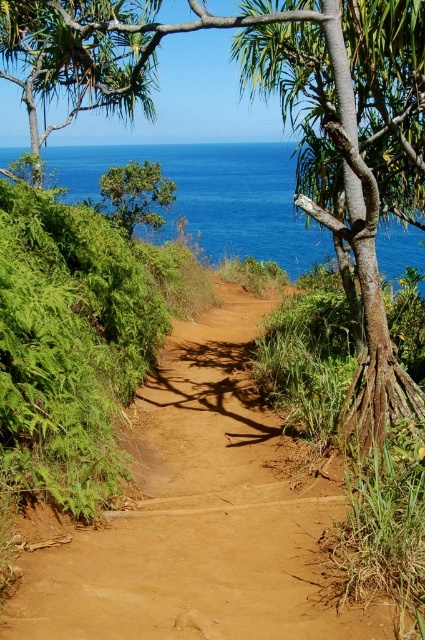
You are a hiker who wants to take a photo of the brown dirt track at center and the green leafy tree at upper left. Which object should you focus on first if you want to capture both in a single frame without moving the camera?

You should focus on the brown dirt track at center first because it is positioned under the green leafy tree at upper left, so adjusting focus to the track ensures the tree remains in the frame above it.

You are a hiker carrying a backpack and need to cross the brown dirt track at center. There are two rocks on either side of the track. The distance between them is 8.48 feet. Can you safely step from one rock to the other without needing to jump?

The two rocks are 8.48 feet apart. Since the average person can comfortably step up to 3 feet without jumping, but 8.48 feet is significantly wider than that, you would need to jump or find an alternative path.

You are standing on the coastal path and want to take a photo of both the green leafy tree at center and the blue water at upper center. Which object should you focus on first to ensure both are in sharp focus?

You should focus on the green leafy tree at center first because it is closer to you than the blue water at upper center. By focusing on the closer object, the background object will still be in focus due to the depth of field.